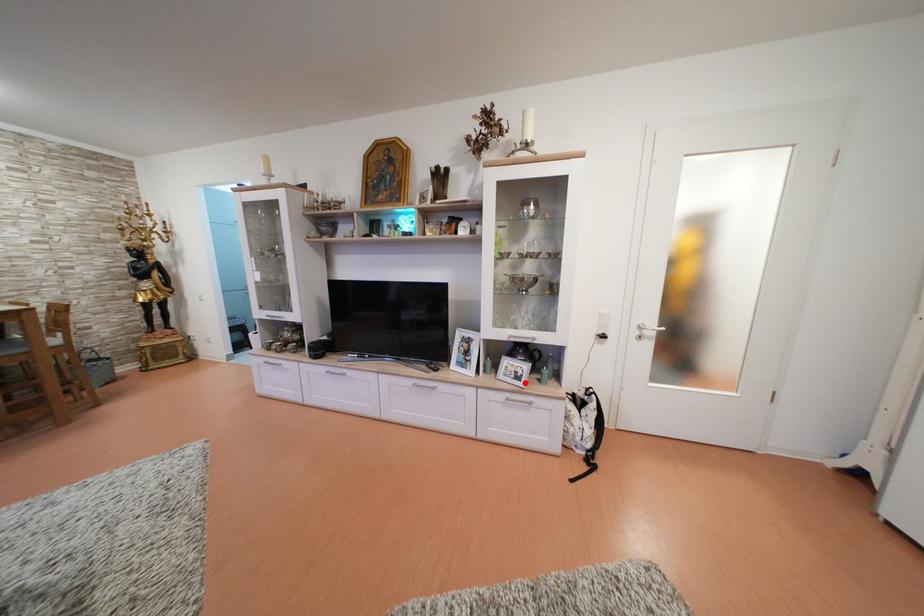
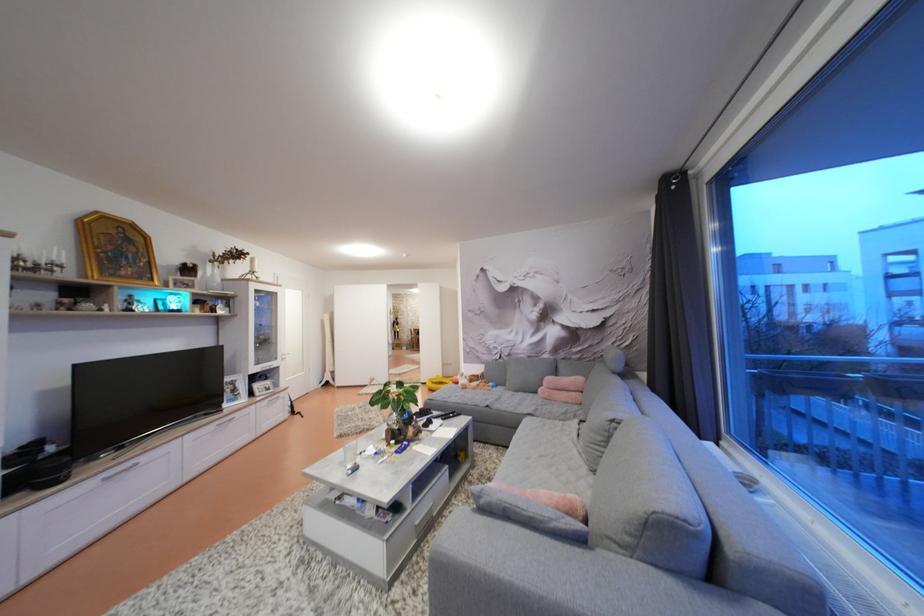
In the second image, find the point that corresponds to the highlighted location in the first image.

(274, 394)